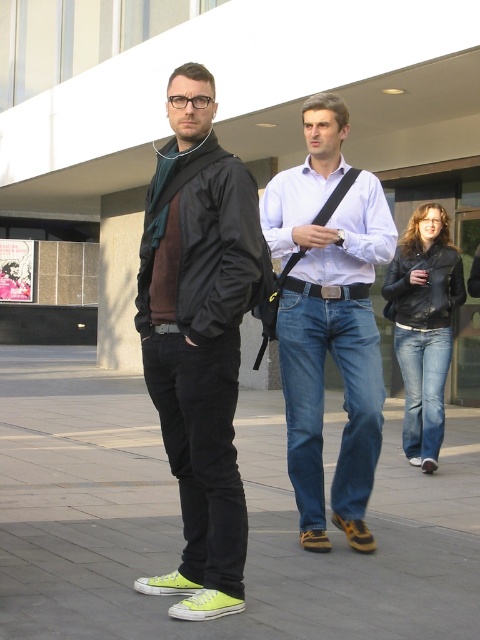
Question: Does matte black jacket at center have a smaller size compared to blue denim jeans at center?

Choices:
 (A) no
 (B) yes

Answer: (A)

Question: Which point appears farthest from the camera in this image?

Choices:
 (A) (422, 355)
 (B) (115, 486)

Answer: (A)

Question: Can you confirm if blue denim jeans at center is bigger than matte white shirt at center?

Choices:
 (A) yes
 (B) no

Answer: (B)

Question: Which object is positioned closest to the blue denim jeans at center?

Choices:
 (A) denim jeans at center
 (B) denim at right
 (C) green canvas shoes at lower center
 (D) matte white shirt at center

Answer: (A)

Question: Which of the following is the farthest from the observer?

Choices:
 (A) denim jeans at center
 (B) matte white shirt at center
 (C) matte black jacket at center
 (D) blue denim jeans at center

Answer: (D)

Question: Observing the image, what is the correct spatial positioning of green canvas shoes at lower center in reference to matte white shirt at center?

Choices:
 (A) below
 (B) above

Answer: (A)